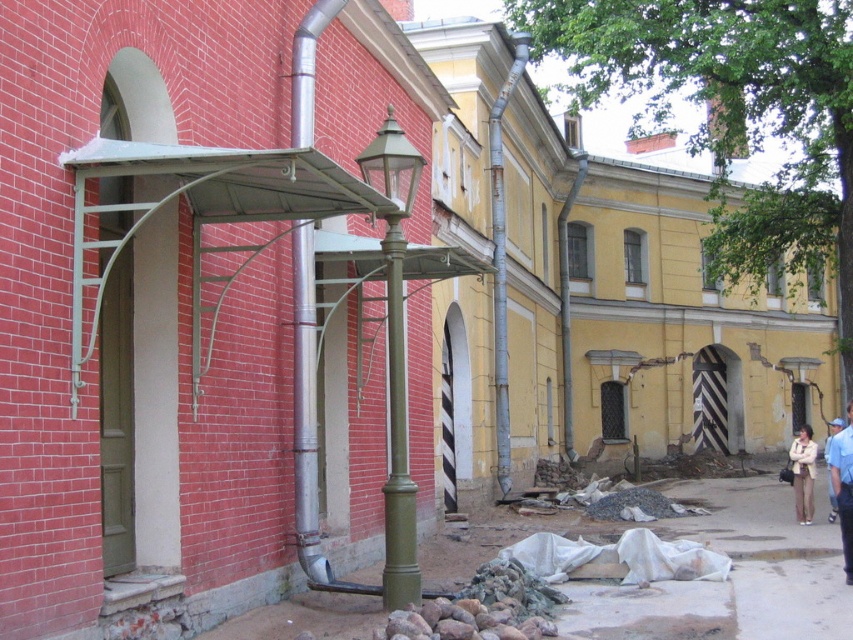
Who is more forward, [843,486] or [804,438]?

Positioned in front is point [843,486].

Between point (831, 474) and point (792, 456), which one is positioned behind?

Point (792, 456)

Find the location of a particular element. light blue uniform at lower right is located at coordinates (843, 486).

Between point (730, 544) and point (390, 426), which one is positioned behind?

The point (730, 544) is behind.

Which is in front, point (796, 634) or point (407, 540)?

Positioned in front is point (796, 634).

Does point (665, 589) come farther from viewer compared to point (397, 592)?

That is True.

Identify the location of smooth concrete pavement at lower center. (732, 572).

Can you confirm if smooth concrete pavement at lower center is positioned to the left of light blue uniform at lower right?

Yes, smooth concrete pavement at lower center is to the left of light blue uniform at lower right.

Is point (694, 604) more distant than point (843, 531)?

No, it is in front of (843, 531).

The image size is (853, 640). In order to click on smooth concrete pavement at lower center in this screenshot , I will do `click(732, 572)`.